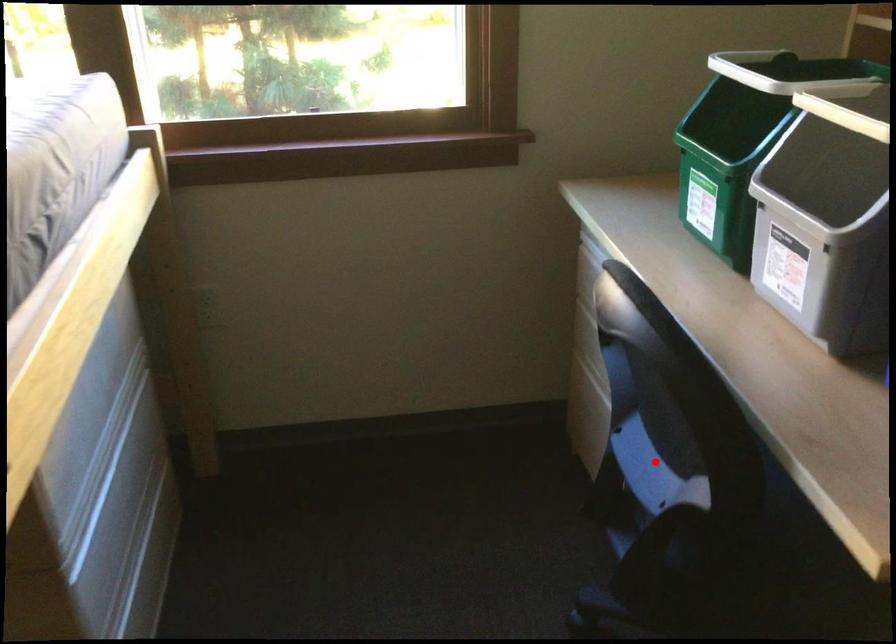
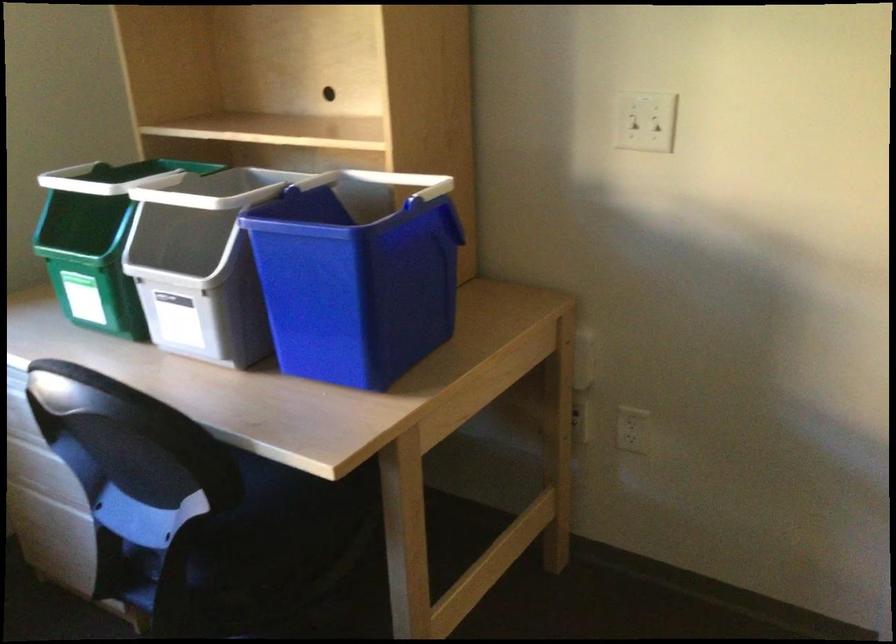
Question: I am providing you with two images of the same scene from different viewpoints. A red point is shown in image1. For the corresponding object point in image2, is it positioned nearer or farther from the camera?

Choices:
 (A) Nearer
 (B) Farther

Answer: (B)